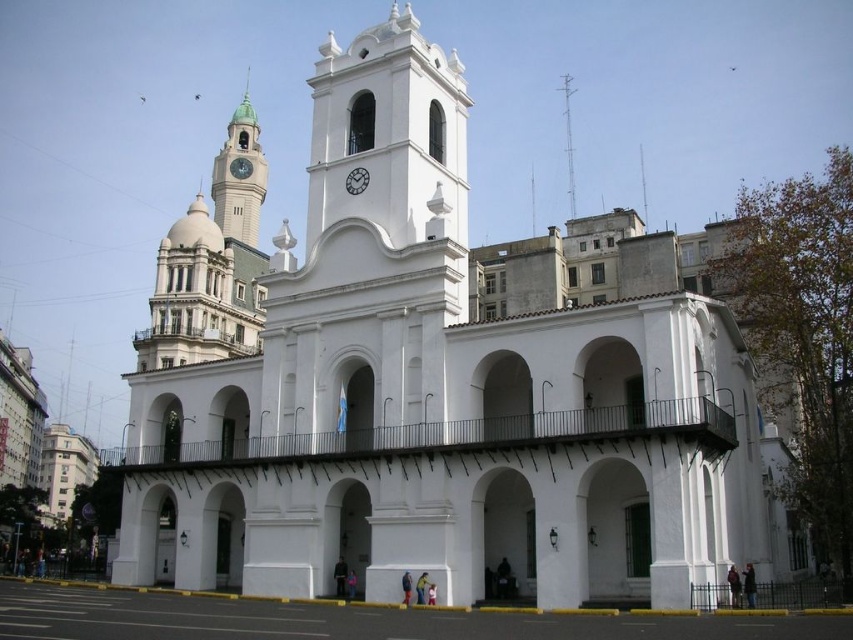
Question: Which of the following is the closest to the observer?

Choices:
 (A) smooth white spire at upper center
 (B) green glass clock tower at upper left
 (C) metallic clock face at center

Answer: (B)

Question: Does green glass clock tower at upper left appear over smooth white spire at upper center?

Choices:
 (A) yes
 (B) no

Answer: (A)

Question: Which point appears closest to the camera in this image?

Choices:
 (A) (234, 168)
 (B) (389, 196)
 (C) (239, 154)
 (D) (567, 173)

Answer: (B)

Question: Is the position of white smooth clock tower at center less distant than that of white matte clock at center?

Choices:
 (A) no
 (B) yes

Answer: (B)

Question: Is green glass clock tower at upper left below metallic clock face at center?

Choices:
 (A) yes
 (B) no

Answer: (B)

Question: Which point is closer to the camera?

Choices:
 (A) (363, 144)
 (B) (357, 186)
 (C) (250, 205)

Answer: (B)